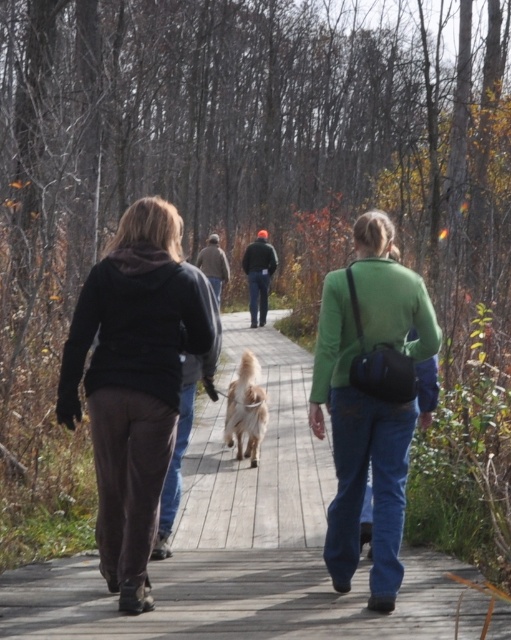
Is wooden boardwalk at center closer to camera compared to green matte jacket at center?

Yes.

Which is behind, point (320, 468) or point (391, 484)?

The point (320, 468) is more distant.

The image size is (511, 640). Describe the element at coordinates (246, 541) in the screenshot. I see `wooden boardwalk at center` at that location.

Locate an element on the screen. wooden boardwalk at center is located at coordinates (246, 541).

Which is more to the right, wooden boardwalk at center or golden fur dog at center?

wooden boardwalk at center

Can you confirm if wooden boardwalk at center is smaller than golden fur dog at center?

Actually, wooden boardwalk at center might be larger than golden fur dog at center.

Identify the location of wooden boardwalk at center. Image resolution: width=511 pixels, height=640 pixels. (246, 541).

Based on the photo, is the position of wooden boardwalk at center more distant than that of matte black hoodie at center?

No, wooden boardwalk at center is in front of matte black hoodie at center.

Does point (332, 490) come farther from viewer compared to point (179, 291)?

Yes, it is behind point (179, 291).

In order to click on wooden boardwalk at center in this screenshot , I will do `click(246, 541)`.